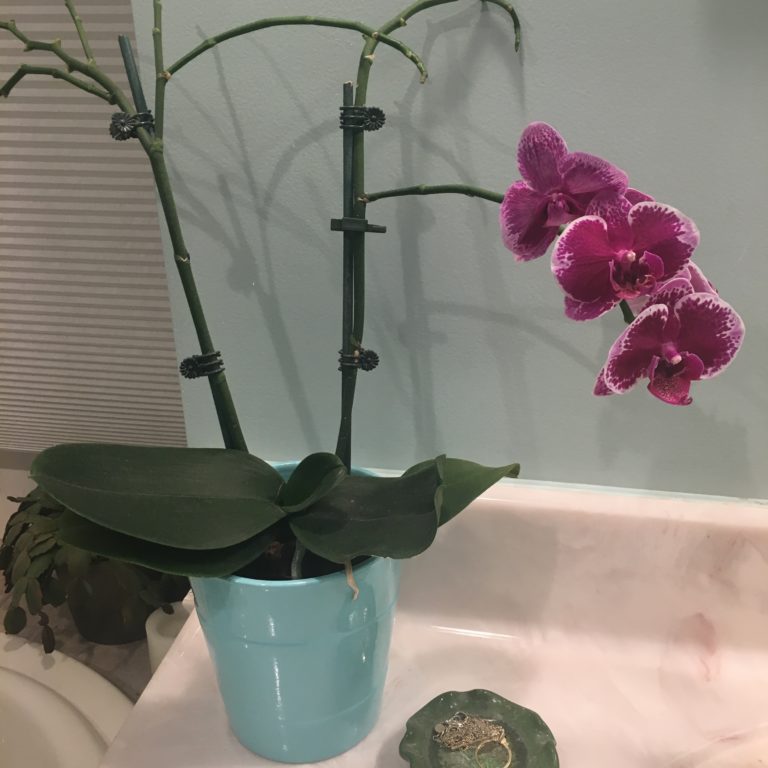
This screenshot has height=768, width=768. In order to click on purple orchid in this screenshot , I will do `click(697, 323)`.